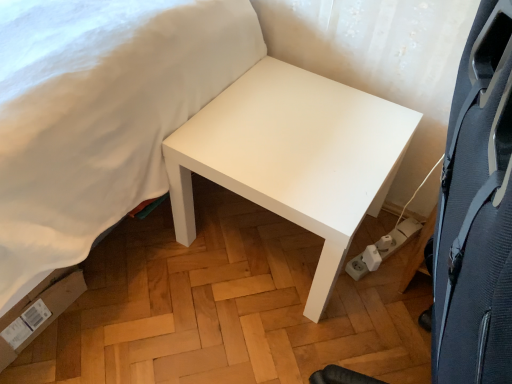
Question: From a real-world perspective, is white matte table at center above or below black textured swivel chair at right?

Choices:
 (A) above
 (B) below

Answer: (B)

Question: Looking at the image, does white matte table at center seem bigger or smaller compared to black textured swivel chair at right?

Choices:
 (A) big
 (B) small

Answer: (B)

Question: Estimate the real-world distances between objects in this image. Which object is farther from the white matte bed at upper left?

Choices:
 (A) black textured swivel chair at right
 (B) white matte table at center
 (C) white plastic socket at lower right

Answer: (C)

Question: Which object is positioned closest to the white matte table at center?

Choices:
 (A) black textured swivel chair at right
 (B) white plastic socket at lower right
 (C) white matte bed at upper left

Answer: (C)